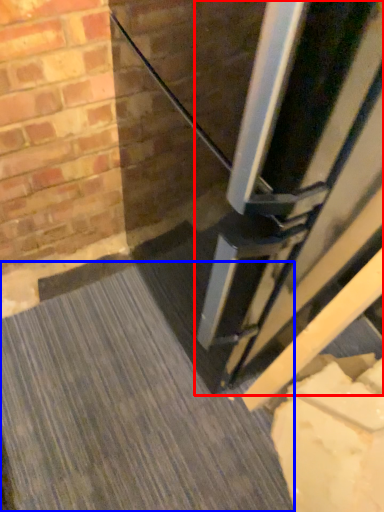
Question: Which of the following is the closest to the observer, door (highlighted by a red box) or concrete (highlighted by a blue box)?

Choices:
 (A) door
 (B) concrete

Answer: (A)